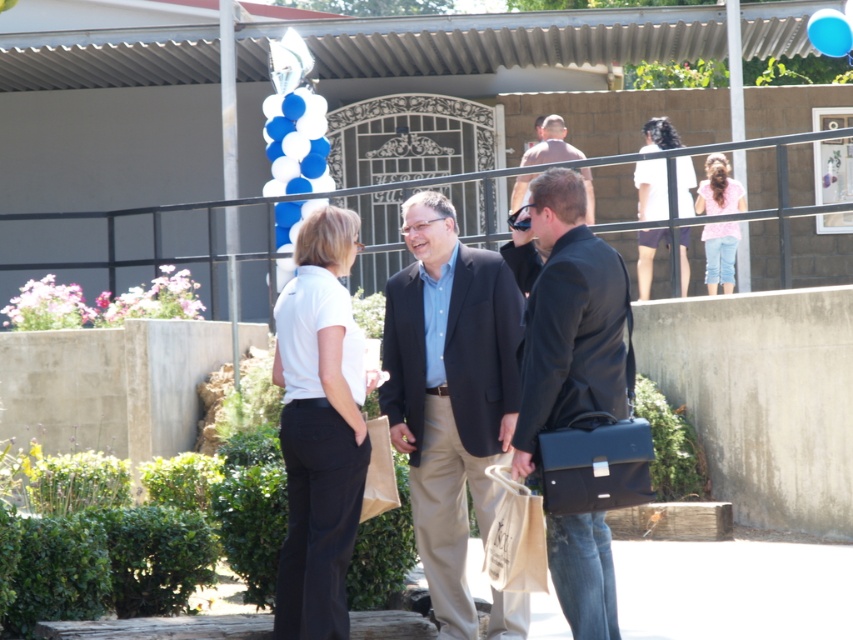
Who is more distant from viewer, [648,216] or [552,152]?

Positioned behind is point [552,152].

Based on the photo, how much distance is there between white cotton shirt at upper right and shiny brown shirt at center?

white cotton shirt at upper right is 3.55 feet from shiny brown shirt at center.

Describe the element at coordinates (651, 189) in the screenshot. This screenshot has width=853, height=640. I see `white cotton shirt at upper right` at that location.

Where is `white cotton shirt at upper right`? This screenshot has height=640, width=853. white cotton shirt at upper right is located at coordinates (651, 189).

Can you confirm if matte black suit at center is shorter than matte black briefcase at center?

No, matte black suit at center is not shorter than matte black briefcase at center.

Between matte black suit at center and matte black briefcase at center, which one appears on the left side from the viewer's perspective?

matte black suit at center is more to the left.

Is point (474, 312) positioned after point (587, 529)?

Yes, it is.

The width and height of the screenshot is (853, 640). I want to click on matte black suit at center, so click(450, 392).

Can you confirm if beige canvas bag at center is positioned above pink cotton shirt at upper right?

Actually, beige canvas bag at center is below pink cotton shirt at upper right.

Does beige canvas bag at center lie behind pink cotton shirt at upper right?

No, beige canvas bag at center is in front of pink cotton shirt at upper right.

This screenshot has height=640, width=853. I want to click on beige canvas bag at center, so click(515, 538).

Identify the location of beige canvas bag at center. (515, 538).